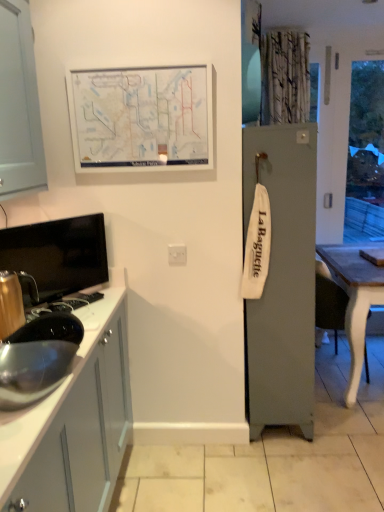
Question: Does satin silver sink at lower left have a larger size compared to white matte map at upper center?

Choices:
 (A) no
 (B) yes

Answer: (A)

Question: Considering the relative sizes of satin silver sink at lower left and white matte map at upper center in the image provided, is satin silver sink at lower left thinner than white matte map at upper center?

Choices:
 (A) yes
 (B) no

Answer: (B)

Question: From the image's perspective, is satin silver sink at lower left located above white matte map at upper center?

Choices:
 (A) no
 (B) yes

Answer: (A)

Question: Is satin silver sink at lower left not close to white matte map at upper center?

Choices:
 (A) no
 (B) yes

Answer: (A)

Question: Considering the relative sizes of satin silver sink at lower left and white matte map at upper center in the image provided, is satin silver sink at lower left taller than white matte map at upper center?

Choices:
 (A) yes
 (B) no

Answer: (B)

Question: Based on their sizes in the image, would you say white plastic electric outlet at center is bigger or smaller than wooden table at right?

Choices:
 (A) big
 (B) small

Answer: (B)

Question: From a real-world perspective, is white plastic electric outlet at center positioned above or below wooden table at right?

Choices:
 (A) above
 (B) below

Answer: (A)

Question: Is white plastic electric outlet at center spatially inside wooden table at right, or outside of it?

Choices:
 (A) inside
 (B) outside

Answer: (B)

Question: Is white plastic electric outlet at center taller or shorter than wooden table at right?

Choices:
 (A) tall
 (B) short

Answer: (B)

Question: From a real-world perspective, is metallic gold kettle at left positioned above or below satin silver sink at lower left?

Choices:
 (A) above
 (B) below

Answer: (B)

Question: Looking at their shapes, would you say metallic gold kettle at left is wider or thinner than satin silver sink at lower left?

Choices:
 (A) thin
 (B) wide

Answer: (B)

Question: From the image's perspective, is metallic gold kettle at left above or below satin silver sink at lower left?

Choices:
 (A) above
 (B) below

Answer: (B)

Question: From their relative heights in the image, would you say metallic gold kettle at left is taller or shorter than satin silver sink at lower left?

Choices:
 (A) short
 (B) tall

Answer: (A)

Question: Does point (155, 126) appear closer or farther from the camera than point (18, 292)?

Choices:
 (A) closer
 (B) farther

Answer: (B)

Question: From a real-world perspective, relative to metallic gold kettle at left, is white matte map at upper center vertically above or below?

Choices:
 (A) above
 (B) below

Answer: (A)